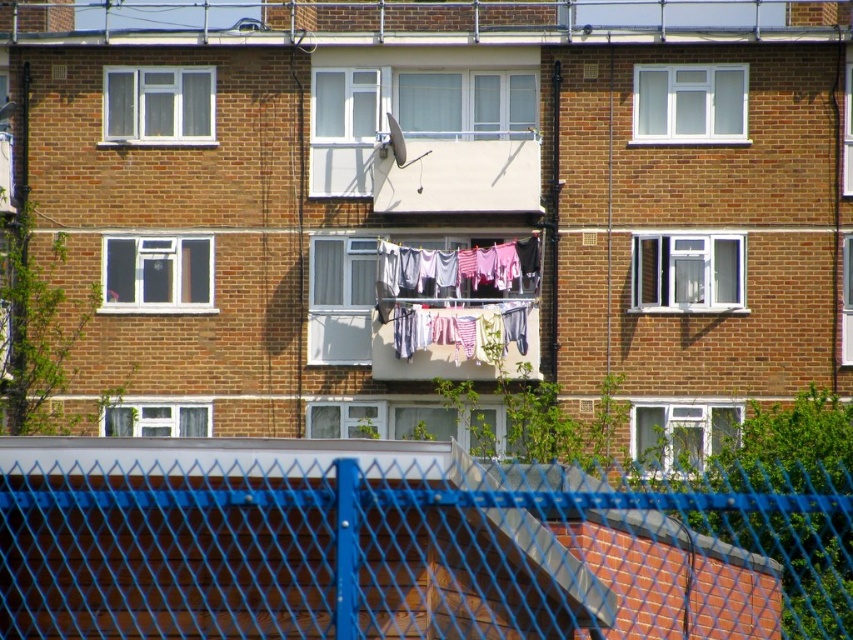
Question: In this image, where is blue wire mesh fence at center located relative to white fabric clothes at center?

Choices:
 (A) right
 (B) left

Answer: (A)

Question: Which of the following is the closest to the observer?

Choices:
 (A) white fabric clothes at center
 (B) blue wire mesh fence at center

Answer: (B)

Question: Is blue wire mesh fence at center in front of white fabric clothes at center?

Choices:
 (A) yes
 (B) no

Answer: (A)

Question: Is blue wire mesh fence at center in front of white fabric clothes at center?

Choices:
 (A) yes
 (B) no

Answer: (A)

Question: Which of the following is the farthest from the observer?

Choices:
 (A) [252, 547]
 (B) [379, 326]

Answer: (B)